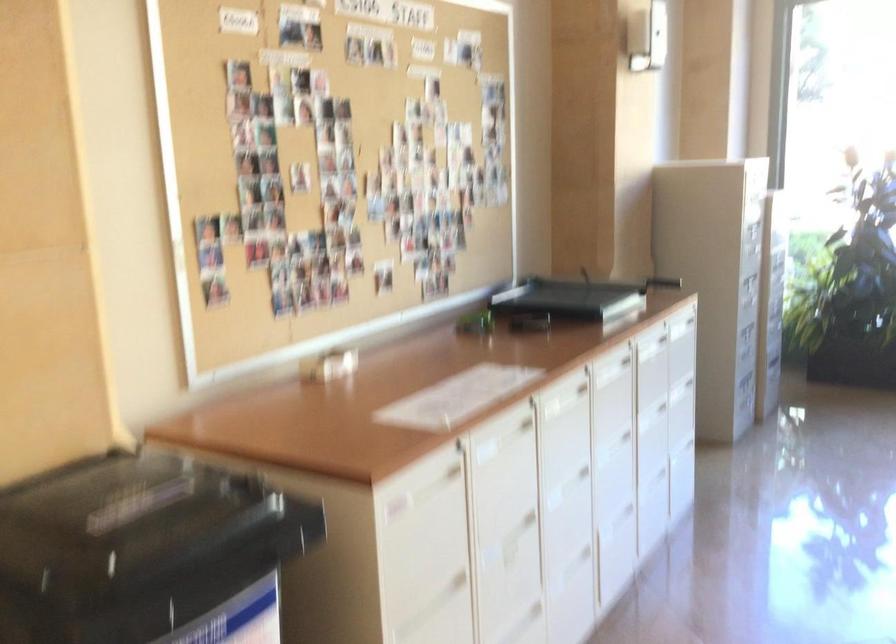
What do you see at coordinates (145, 552) in the screenshot? I see `the black trash can lid` at bounding box center [145, 552].